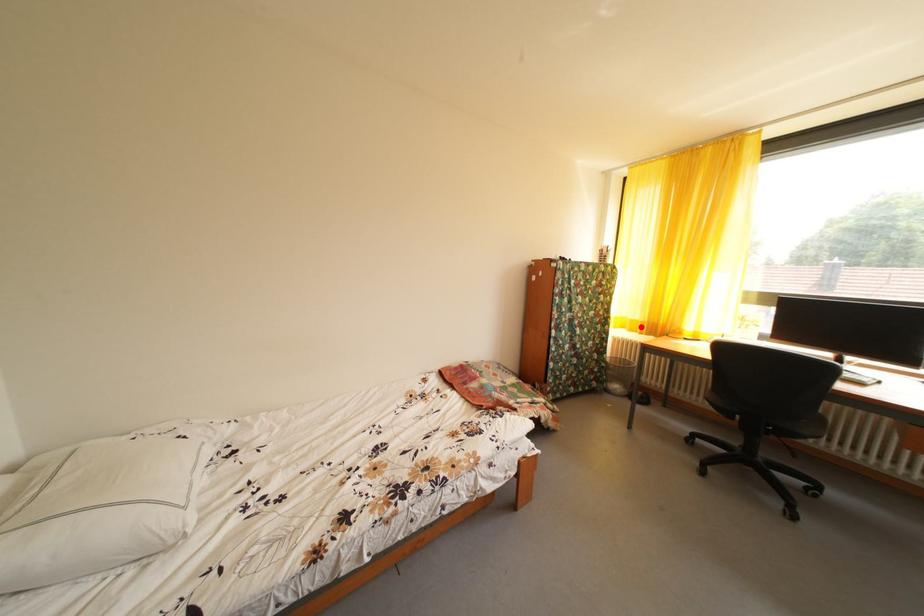
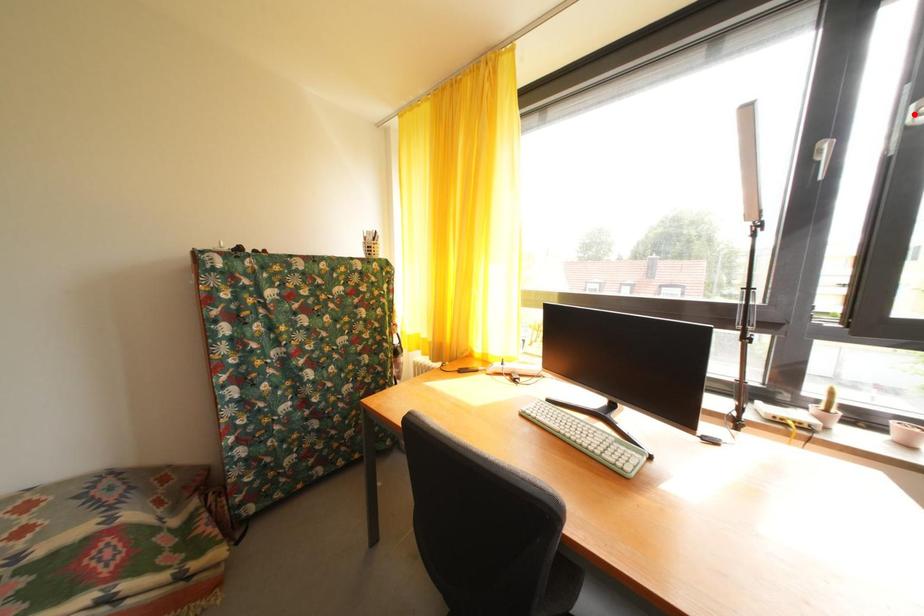
I am providing you with two images of the same scene from different viewpoints. A red point is marked on the first image and another point is marked on the second image. Does the point marked in image1 correspond to the same location as the one in image2?

No